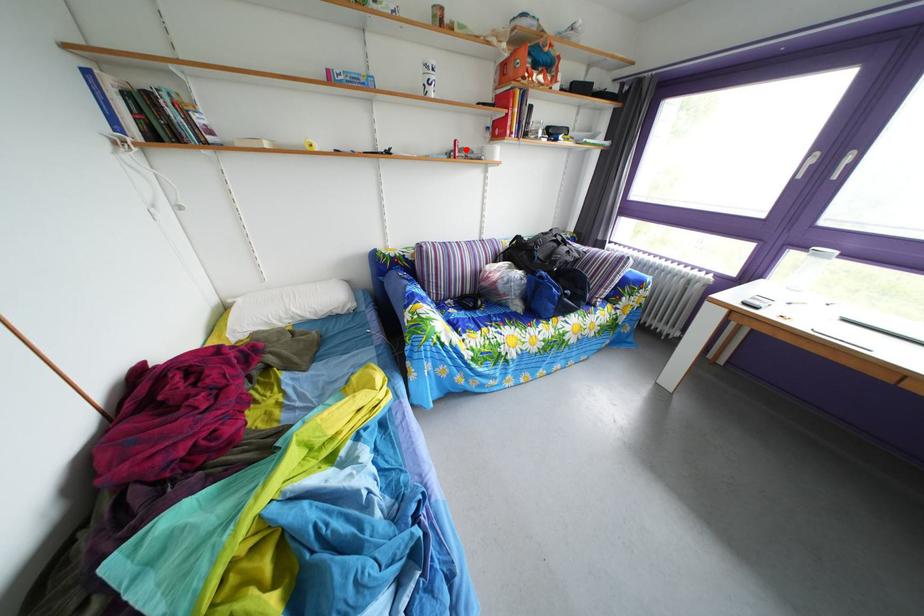
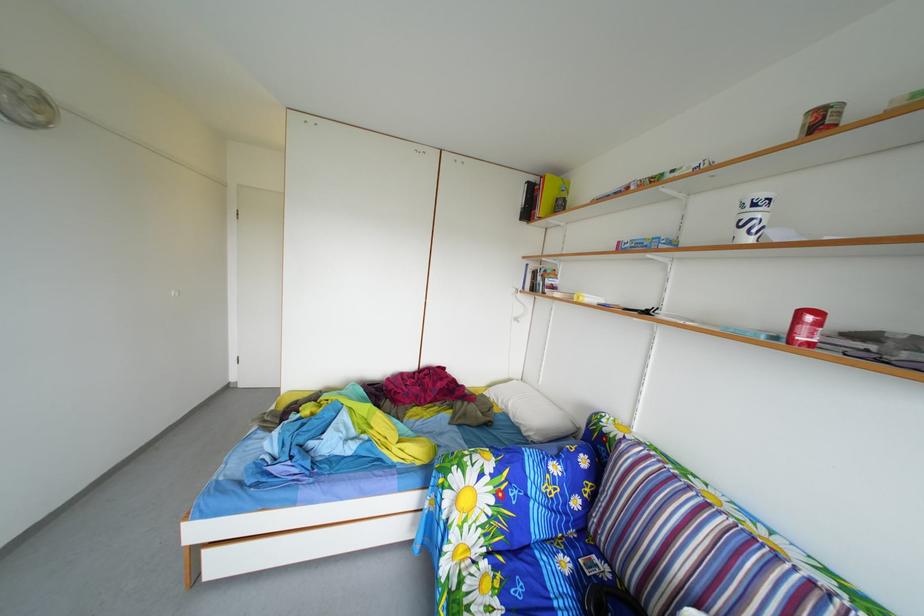
Question: I am providing you with two images of the same scene from different viewpoints. Given a red point in image1, look at the same physical point in image2. Is it:

Choices:
 (A) Closer to the viewpoint
 (B) Farther from the viewpoint

Answer: (B)